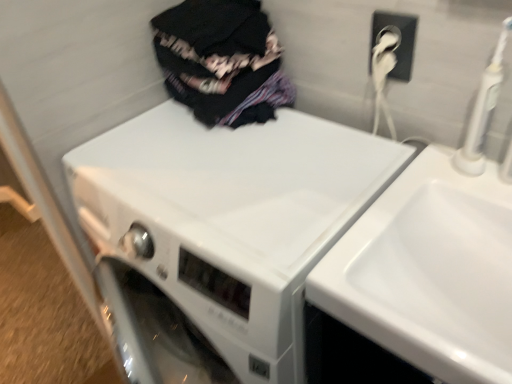
Find the location of a particular element. This screenshot has height=384, width=512. free space in front of dark fabric clothes at upper center is located at coordinates (222, 163).